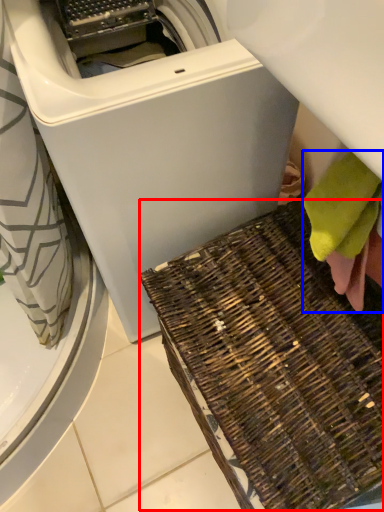
Question: Which of the following is the closest to the observer, waste (highlighted by a red box) or bath towel (highlighted by a blue box)?

Choices:
 (A) waste
 (B) bath towel

Answer: (A)